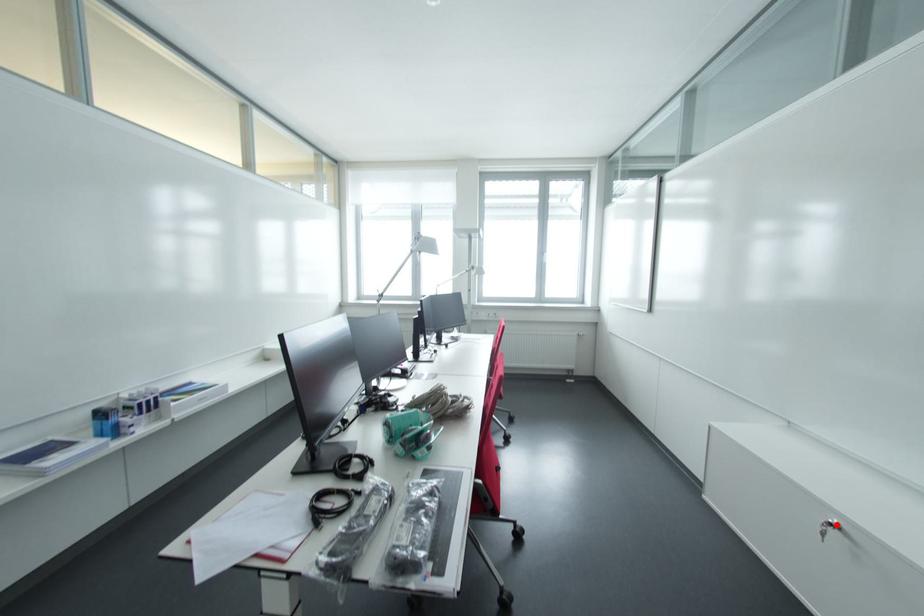
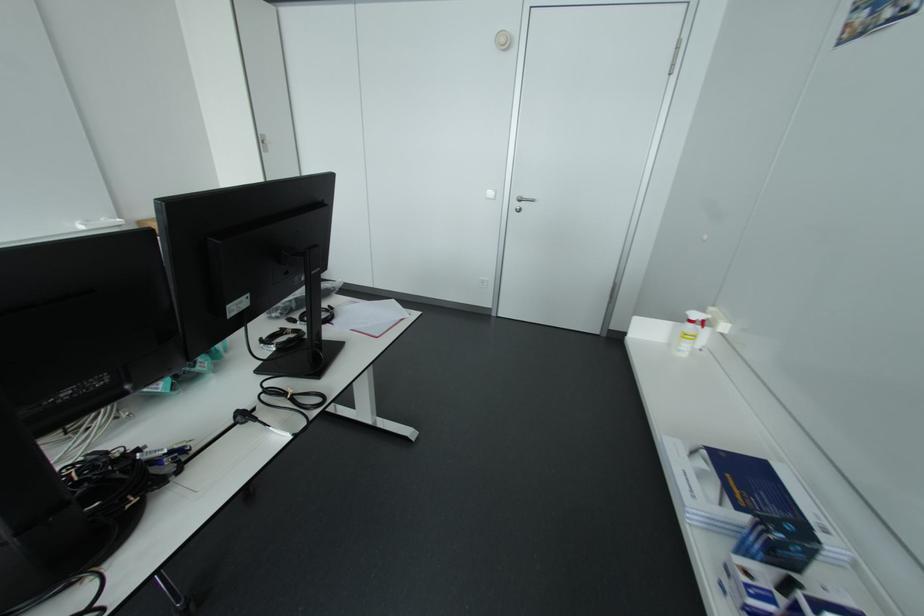
Question: I am providing you with two images of the same scene from different viewpoints. A red point is marked on the first image. Is the red point's position out of view in image 2?

Choices:
 (A) Yes
 (B) No

Answer: (A)